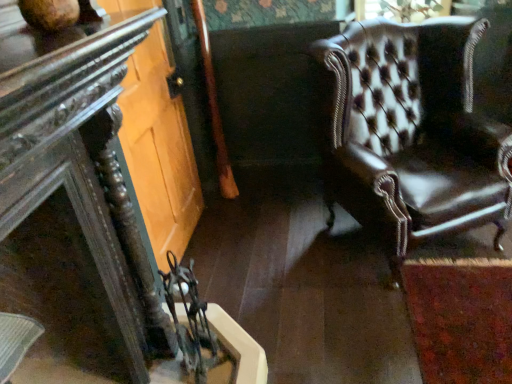
At what (x,y) coordinates should I click in order to perform the action: click on free space in front of leather armchair at right. Please return your answer as a coordinate pair (x, y). This screenshot has width=512, height=384. Looking at the image, I should click on (425, 319).